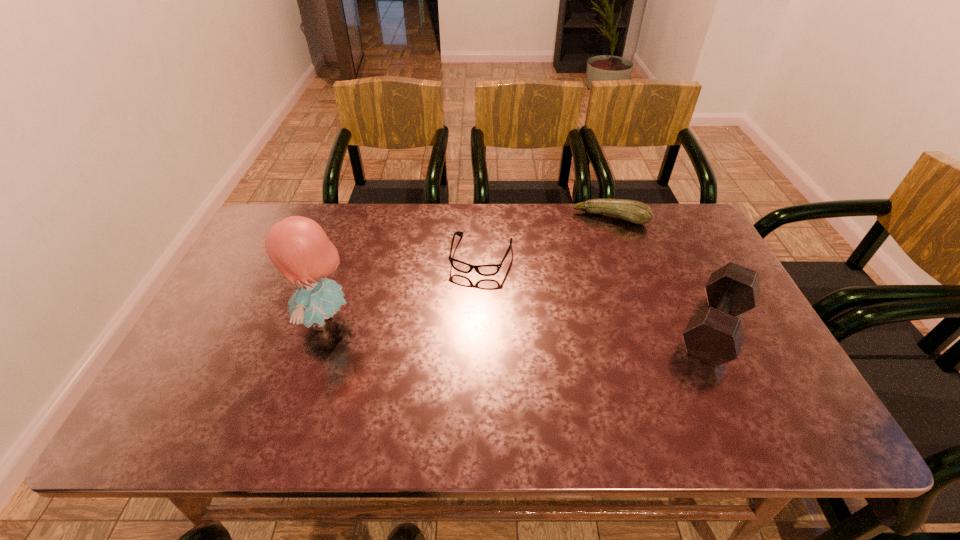
Locate an element on the screen. free space located 0.310m on the back of the dumbbell is located at coordinates (663, 221).

This screenshot has width=960, height=540. I want to click on vacant space located on the front-facing side of the spectacles, so (440, 395).

Identify the location of free region located on the front-facing side of the spectacles. The width and height of the screenshot is (960, 540). (468, 299).

Where is `free space located on the front-facing side of the spectacles`? free space located on the front-facing side of the spectacles is located at coordinates (454, 348).

Identify the location of vacant space situated at the stem end of the farthest object. The height and width of the screenshot is (540, 960). (582, 283).

I want to click on vacant space situated 0.090m at the stem end of the farthest object, so click(x=594, y=245).

Locate an element on the screen. This screenshot has height=540, width=960. free region located 0.400m at the stem end of the farthest object is located at coordinates (571, 315).

You are a GUI agent. You are given a task and a screenshot of the screen. Output one action in this format:
    pyautogui.click(x=<x>, y=<y>)
    Task: Click on the spectacles that is at the far edge
    Image resolution: width=960 pixels, height=540 pixels.
    Given the screenshot: What is the action you would take?
    pyautogui.click(x=485, y=270)

At what (x,y) coordinates should I click in order to perform the action: click on zucchini present at the far edge. Please return your answer as a coordinate pair (x, y). The width and height of the screenshot is (960, 540). Looking at the image, I should click on (636, 212).

The height and width of the screenshot is (540, 960). What are the coordinates of `object that is at the near edge` in the screenshot? It's located at (714, 335).